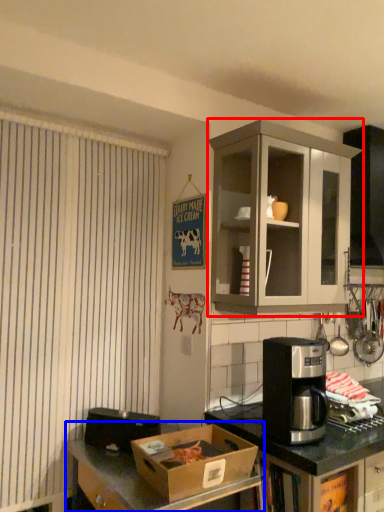
Question: Which point is further to the camera, cabinetry (highlighted by a red box) or desk (highlighted by a blue box)?

Choices:
 (A) cabinetry
 (B) desk

Answer: (A)